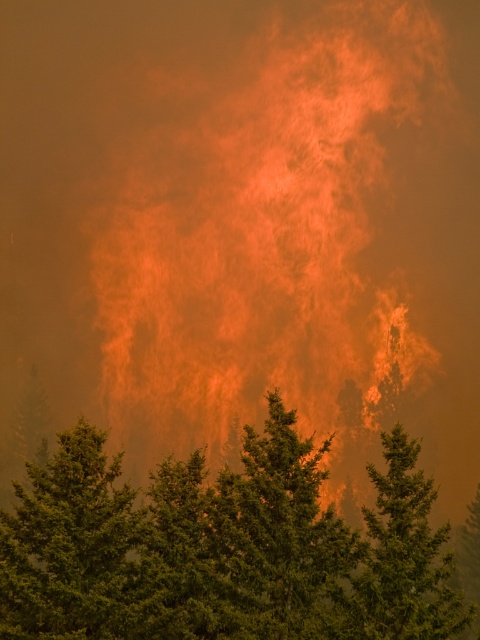
Question: Among these points, which one is nearest to the camera?

Choices:
 (A) (414, 486)
 (B) (113, 493)
 (C) (228, 596)

Answer: (A)

Question: Among these points, which one is farthest from the camera?

Choices:
 (A) (31, 577)
 (B) (415, 509)
 (C) (64, 586)

Answer: (B)

Question: Among these points, which one is nearest to the camera?

Choices:
 (A) (136, 509)
 (B) (12, 532)
 (C) (395, 628)

Answer: (B)

Question: Is green textured tree at center wider than green textured pine tree at center?

Choices:
 (A) yes
 (B) no

Answer: (A)

Question: Can you confirm if green textured tree at left is thinner than green textured pine tree at center?

Choices:
 (A) no
 (B) yes

Answer: (B)

Question: Is green textured tree at center to the right of green textured pine tree at center from the viewer's perspective?

Choices:
 (A) yes
 (B) no

Answer: (B)